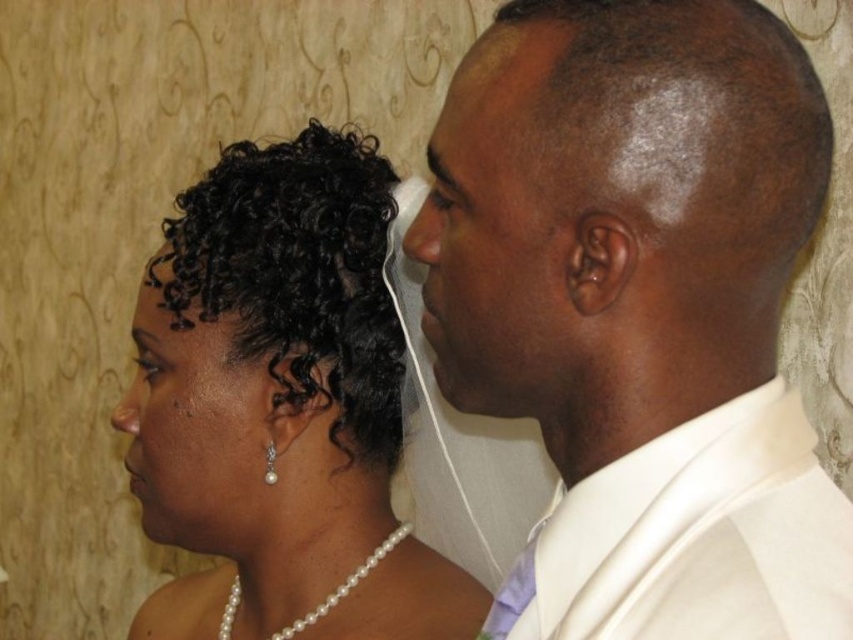
You are a photographer at a wedding event. You need to adjust the camera focus so that both the shiny white suit at right and the satin skin face at center are in focus. Given that the depth of field can only cover objects within a 10 cm height difference, can you achieve this?

The shiny white suit at right is taller than the satin skin face at center. Since the height difference between them is within the 10 cm depth of field range, the photographer can adjust the focus to include both objects.

You are a photographer at a wedding. You need to adjust the lighting to ensure both the shiny white suit at right and the black pearl earring at lower left are visible. Considering their sizes, which object might require more focused lighting to stand out?

The black pearl earring at lower left requires more focused lighting because it is smaller in size than the shiny white suit at right, making it harder to notice in the photo.

You are taking a photo of the two people in the scene. You want to focus on the closer point between point (527, 307) and point (173, 394). Which point should you focus on?

Point (527, 307) is closer to the camera than point (173, 394), so you should focus on point (527, 307).